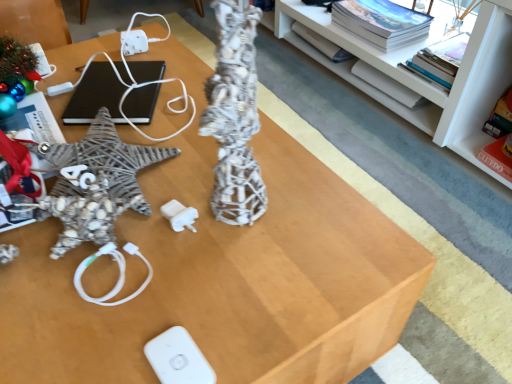
I want to click on unoccupied area behind black matte laptop at upper left, so click(x=141, y=54).